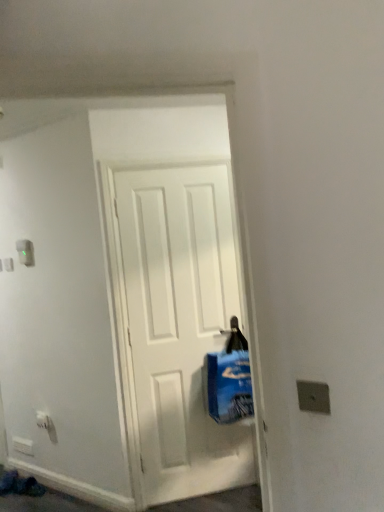
Question: Does blue plastic bag at center come behind white plastic light switch at upper left?

Choices:
 (A) yes
 (B) no

Answer: (B)

Question: Can you confirm if blue plastic bag at center is taller than white plastic light switch at upper left?

Choices:
 (A) no
 (B) yes

Answer: (B)

Question: Considering the relative positions of blue plastic bag at center and white plastic light switch at upper left in the image provided, is blue plastic bag at center to the left of white plastic light switch at upper left from the viewer's perspective?

Choices:
 (A) yes
 (B) no

Answer: (B)

Question: Can you confirm if blue plastic bag at center is wider than white plastic light switch at upper left?

Choices:
 (A) no
 (B) yes

Answer: (B)

Question: Can you confirm if blue plastic bag at center is shorter than white plastic light switch at upper left?

Choices:
 (A) yes
 (B) no

Answer: (B)

Question: Is blue plastic bag at center to the right of white plastic light switch at upper left from the viewer's perspective?

Choices:
 (A) no
 (B) yes

Answer: (B)

Question: Is blue plastic bag at center oriented towards white plastic electric outlet at lower left?

Choices:
 (A) yes
 (B) no

Answer: (B)

Question: Is blue plastic bag at center not close to white plastic electric outlet at lower left?

Choices:
 (A) yes
 (B) no

Answer: (A)

Question: From the image's perspective, is blue plastic bag at center above white plastic electric outlet at lower left?

Choices:
 (A) yes
 (B) no

Answer: (A)

Question: Are blue plastic bag at center and white plastic electric outlet at lower left beside each other?

Choices:
 (A) no
 (B) yes

Answer: (A)

Question: Does blue plastic bag at center lie in front of white plastic electric outlet at lower left?

Choices:
 (A) no
 (B) yes

Answer: (B)

Question: Considering the relative positions of blue plastic bag at center and white plastic electric outlet at lower left in the image provided, is blue plastic bag at center to the left of white plastic electric outlet at lower left from the viewer's perspective?

Choices:
 (A) yes
 (B) no

Answer: (B)

Question: Can you confirm if white plastic electric outlet at lower left is wider than blue plastic bag at center?

Choices:
 (A) no
 (B) yes

Answer: (A)